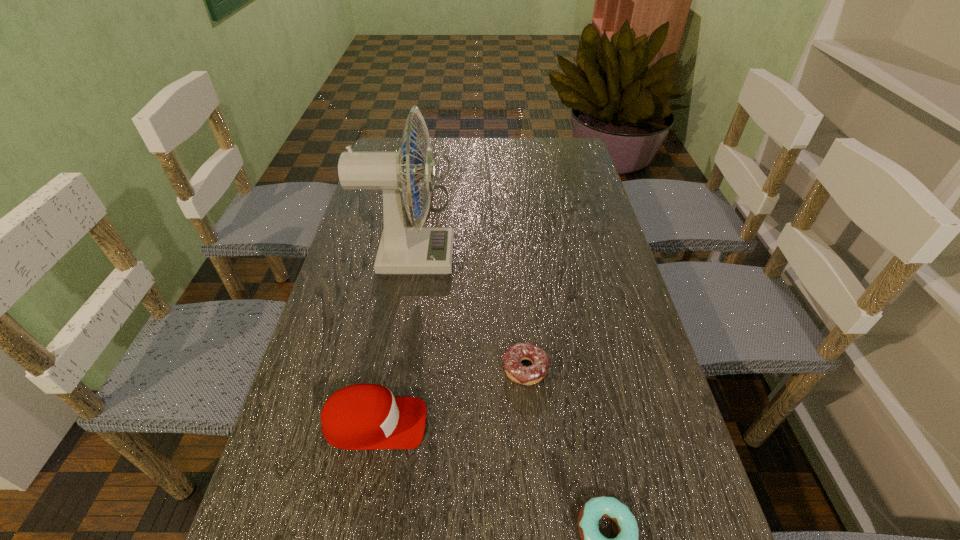
Identify the location of vacant area that lies between the left doughnut and the fan. (468, 313).

Where is `vacant point located between the fourth shortest object and the baseball cap`? This screenshot has width=960, height=540. vacant point located between the fourth shortest object and the baseball cap is located at coordinates (x=401, y=303).

Identify which object is located as the second nearest to the baseball cap. Please provide its 2D coordinates. Your answer should be formatted as a tuple, i.e. [(x, y)], where the tuple contains the x and y coordinates of a point satisfying the conditions above.

[(628, 539)]

I want to click on object that is the fourth closest one to the right doughnut, so click(438, 153).

The width and height of the screenshot is (960, 540). Identify the location of free space that satisfies the following two spatial constraints: 1. on the front side of the left doughnut; 2. on the front-facing side of the fourth farthest object. (530, 423).

What are the coordinates of `free location that satisfies the following two spatial constraints: 1. on the back side of the second object from right to left; 2. on the front-facing side of the tallest object` in the screenshot? It's located at (516, 258).

Where is `free location that satisfies the following two spatial constraints: 1. on the side of the farther doughnut with the handle; 2. on the right side of the fourth shortest object`? free location that satisfies the following two spatial constraints: 1. on the side of the farther doughnut with the handle; 2. on the right side of the fourth shortest object is located at coordinates (396, 369).

Locate an element on the screen. Image resolution: width=960 pixels, height=540 pixels. free space in the image that satisfies the following two spatial constraints: 1. on the side of the farthest object with the handle; 2. on the left side of the fourth object from left to right is located at coordinates (396, 369).

Identify the location of free space that satisfies the following two spatial constraints: 1. on the front-facing side of the fourth tallest object; 2. on the left side of the tallest object. Image resolution: width=960 pixels, height=540 pixels. (389, 369).